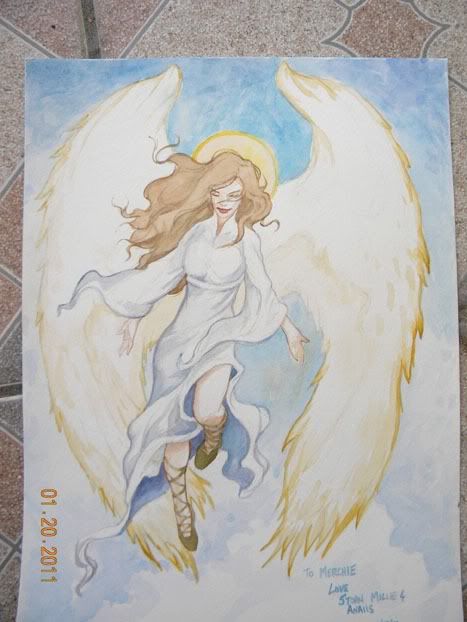
Find the location of a particular element. This screenshot has width=467, height=622. art is located at coordinates (231, 531).